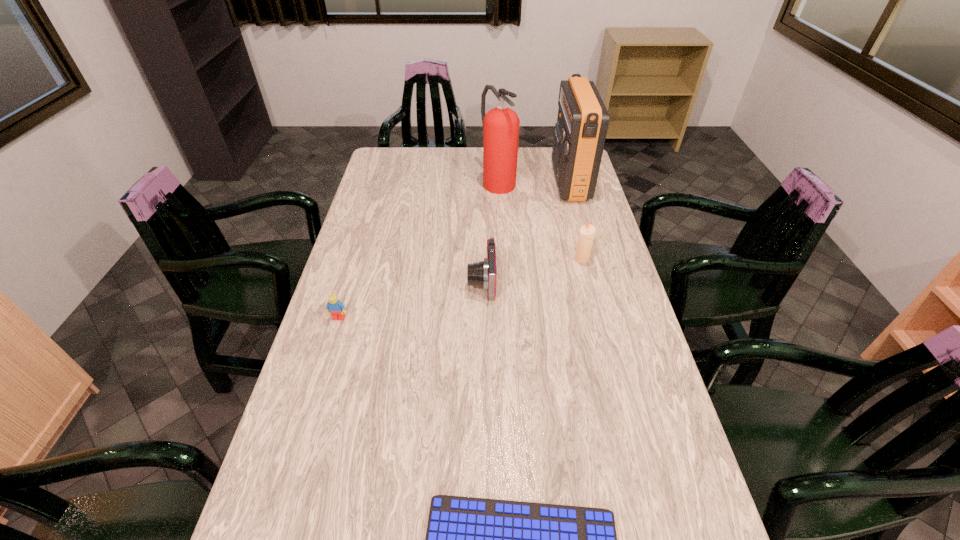
At what (x,y) coordinates should I click in order to perform the action: click on free space located 0.280m on the front of the candle. Please return your answer as a coordinate pair (x, y). Image resolution: width=960 pixels, height=540 pixels. Looking at the image, I should click on (600, 332).

Locate an element on the screen. This screenshot has height=540, width=960. vacant space located 0.250m on the front-facing side of the camera is located at coordinates (389, 281).

What are the coordinates of `free space located on the front-facing side of the camera` in the screenshot? It's located at (430, 281).

Where is `free location located 0.120m on the front-facing side of the camera`? Image resolution: width=960 pixels, height=540 pixels. free location located 0.120m on the front-facing side of the camera is located at coordinates (430, 281).

Find the location of a particular element. vacant area situated on the face of the Lego is located at coordinates [x=317, y=393].

At what (x,y) coordinates should I click in order to perform the action: click on fire extinguisher at the far edge. Please return your answer as a coordinate pair (x, y). Image resolution: width=960 pixels, height=540 pixels. Looking at the image, I should click on (501, 124).

The height and width of the screenshot is (540, 960). Find the location of `radio receiver that is positioned at the far edge`. radio receiver that is positioned at the far edge is located at coordinates (580, 132).

Image resolution: width=960 pixels, height=540 pixels. In order to click on object that is positioned at the left edge in this screenshot , I will do `click(336, 308)`.

Identify the location of radio receiver positioned at the right edge. The width and height of the screenshot is (960, 540). (580, 132).

Identify the location of candle that is at the right edge. (587, 232).